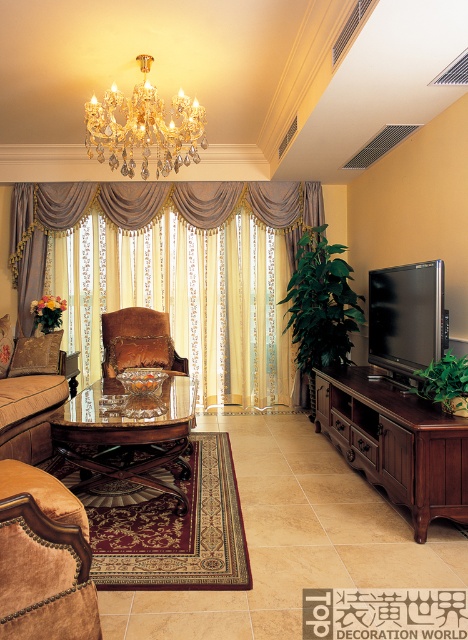
You are standing in the luxurious living room and want to take a photo of both the ornate chandelier and the large window with its curtains. You notice two points marked in the room. Which point, point (387, 492) or point (143, 316), is closer to you and would be better for framing both the chandelier and the window in your shot?

Point (387, 492) is closer to the camera than point (143, 316), so it would be better for framing both the ornate chandelier and the large window with its curtains since it is nearer to your position.

You are standing in the luxurious living room and want to determine which point is closer to you. The points are point (70,316) and point (160,141). Which one is closer?

Point (70,316) is further to the viewer than point (160,141), so the closer point is point (160,141).

You are standing in the living room and want to place a decorative vase on the closest object to you between the brown wood tv stand at right and the velvet brown chair at center. Which object should you choose?

The brown wood tv stand at right is closer to the viewer than the velvet brown chair at center, so you should place the decorative vase on the brown wood tv stand at right.